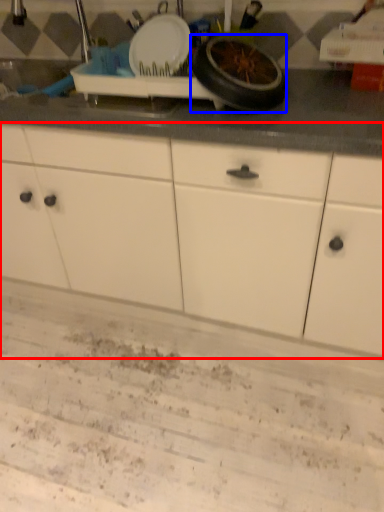
Question: Which object is closer to the camera taking this photo, cabinetry (highlighted by a red box) or wheel (highlighted by a blue box)?

Choices:
 (A) cabinetry
 (B) wheel

Answer: (A)